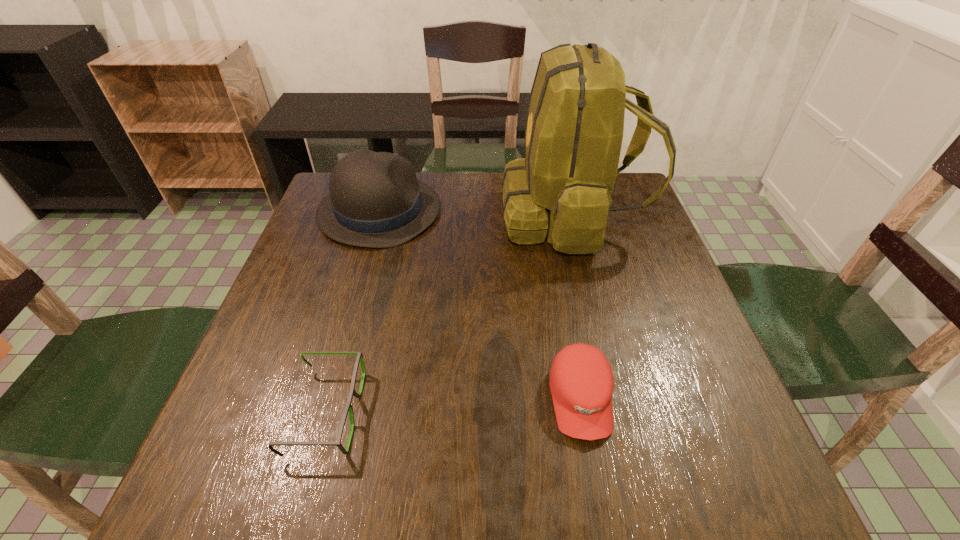
In order to click on vacant space at the near edge of the desktop in this screenshot , I will do `click(539, 467)`.

Where is `vacant region at the left edge of the desktop`? The image size is (960, 540). vacant region at the left edge of the desktop is located at coordinates (249, 382).

Find the location of a particular element. The height and width of the screenshot is (540, 960). vacant space at the right edge is located at coordinates pyautogui.click(x=622, y=258).

At what (x,y) coordinates should I click in order to perform the action: click on vacant region at the far right corner of the desktop. Please return your answer as a coordinate pair (x, y). The image size is (960, 540). Looking at the image, I should click on (621, 207).

The image size is (960, 540). Find the location of `blank area at the near right corner`. blank area at the near right corner is located at coordinates (670, 459).

Find the location of `vacant point located between the tallest object and the second tallest object`. vacant point located between the tallest object and the second tallest object is located at coordinates (475, 213).

At what (x,y) coordinates should I click in order to perform the action: click on unoccupied area between the backpack and the second tallest object. Please return your answer as a coordinate pair (x, y). The image size is (960, 540). Looking at the image, I should click on (475, 213).

Where is `vacant region between the cap and the third shortest object`? vacant region between the cap and the third shortest object is located at coordinates (480, 305).

I want to click on free space between the second shortest object and the shortest object, so click(453, 406).

Locate an element on the screen. The height and width of the screenshot is (540, 960). unoccupied area between the backpack and the second shortest object is located at coordinates (576, 307).